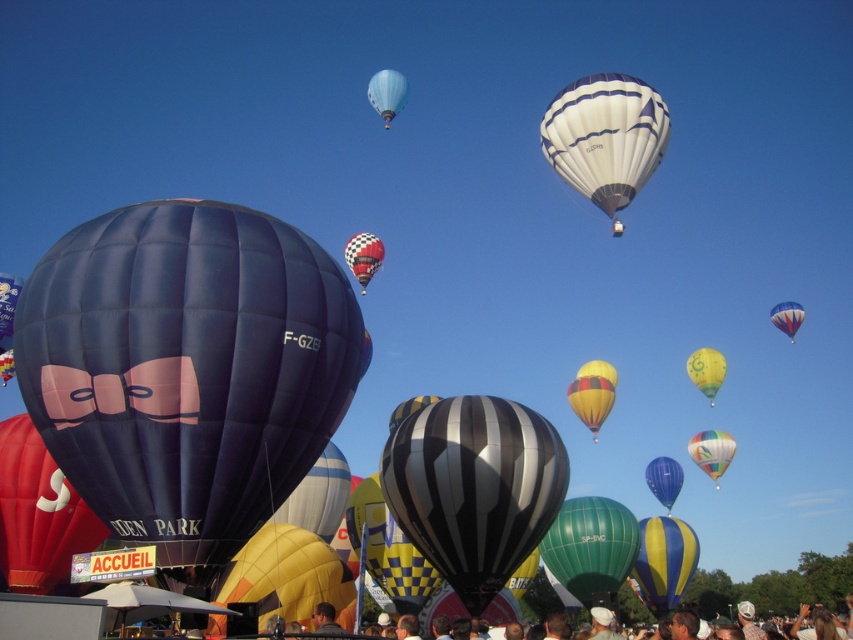
In the scene shown: You are a photographer trying to capture a clear shot of the blue striped hot air balloon at upper right without any obstructions. Based on the scene, will the yellowcheckered fabricballoon at center block your view?

The yellowcheckered fabricballoon at center is in front of the blue striped hot air balloon at upper right, so it will block the view of the blue striped hot air balloon at upper right.

You are a photographer trying to capture a photo that includes both the light blue fabric balloon at upper center and the checkered fabric hot air balloon at center. Based on their positions, which balloon should you adjust your camera to focus on first to ensure both are in the frame?

The light blue fabric balloon at upper center is to the left of the checkered fabric hot air balloon at center. To include both in the frame, focus on the checkered fabric hot air balloon at center first, as it is positioned to the right, allowing the light blue one to naturally fall into the left side of the frame.